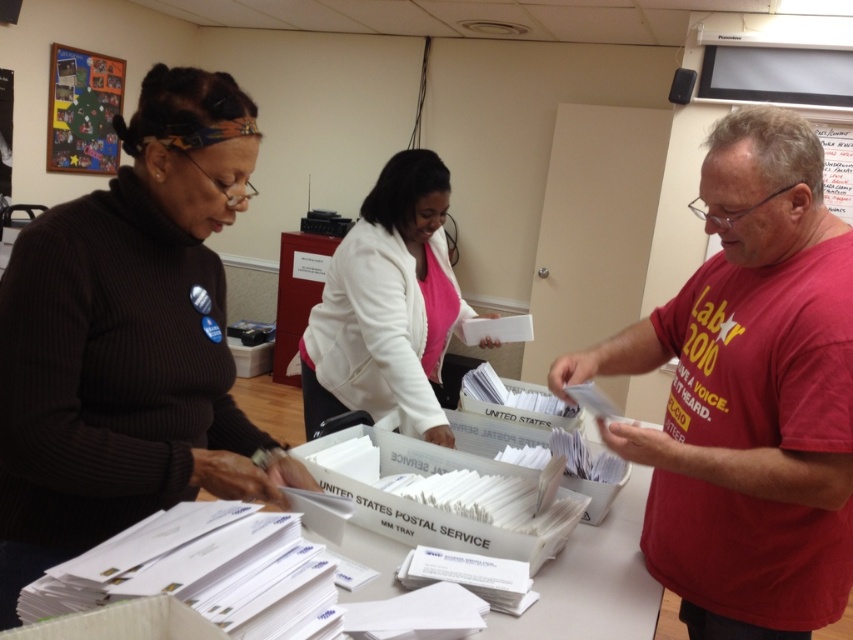
Question: Observing the image, what is the correct spatial positioning of ribbed brown sweater at left in reference to red cotton t-shirt at center?

Choices:
 (A) left
 (B) right

Answer: (A)

Question: Considering the real-world distances, which object is farthest from the ribbed brown sweater at left?

Choices:
 (A) white matte jacket at center
 (B) red cotton t-shirt at center

Answer: (B)

Question: Does ribbed brown sweater at left have a larger size compared to red cotton t-shirt at center?

Choices:
 (A) no
 (B) yes

Answer: (A)

Question: Estimate the real-world distances between objects in this image. Which object is farther from the white matte jacket at center?

Choices:
 (A) red cotton t-shirt at center
 (B) ribbed brown sweater at left
 (C) white paper at center

Answer: (B)

Question: Which point appears farthest from the camera in this image?

Choices:
 (A) (175, 129)
 (B) (646, 604)
 (C) (434, 339)
 (D) (842, 582)

Answer: (C)

Question: Does ribbed brown sweater at left appear under white matte jacket at center?

Choices:
 (A) yes
 (B) no

Answer: (A)